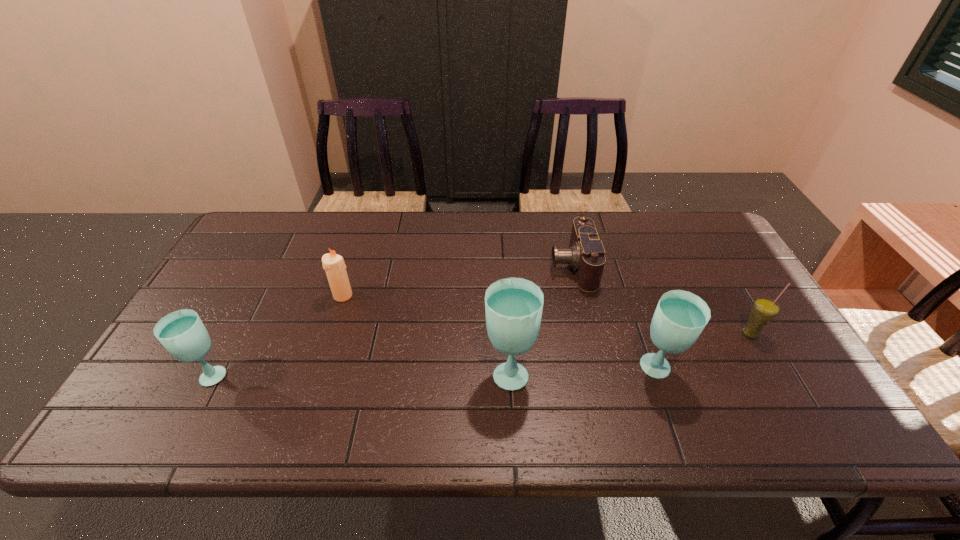
To make them evenly spaced by inserting another glass_(drink_container) among them, please locate a free space for this new glass_(drink_container). Please provide its 2D coordinates. Your answer should be formatted as a tuple, i.e. [(x, y)], where the tuple contains the x and y coordinates of a point satisfying the conditions above.

[(360, 373)]